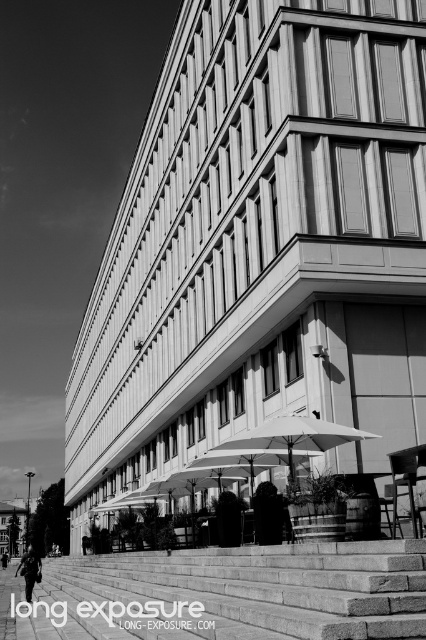
Question: Can you confirm if granite steps at lower center is positioned below white fabric umbrella at center?

Choices:
 (A) no
 (B) yes

Answer: (B)

Question: Among these points, which one is farthest from the camera?

Choices:
 (A) (299, 449)
 (B) (112, 614)

Answer: (A)

Question: Observing the image, what is the correct spatial positioning of granite steps at lower center in reference to white fabric umbrella at center?

Choices:
 (A) below
 (B) above

Answer: (A)

Question: Which of the following is the farthest from the observer?

Choices:
 (A) white fabric umbrella at center
 (B) granite steps at lower center

Answer: (A)

Question: Is granite steps at lower center smaller than white fabric umbrella at center?

Choices:
 (A) no
 (B) yes

Answer: (A)

Question: Which of the following is the closest to the observer?

Choices:
 (A) (157, 560)
 (B) (284, 436)

Answer: (B)